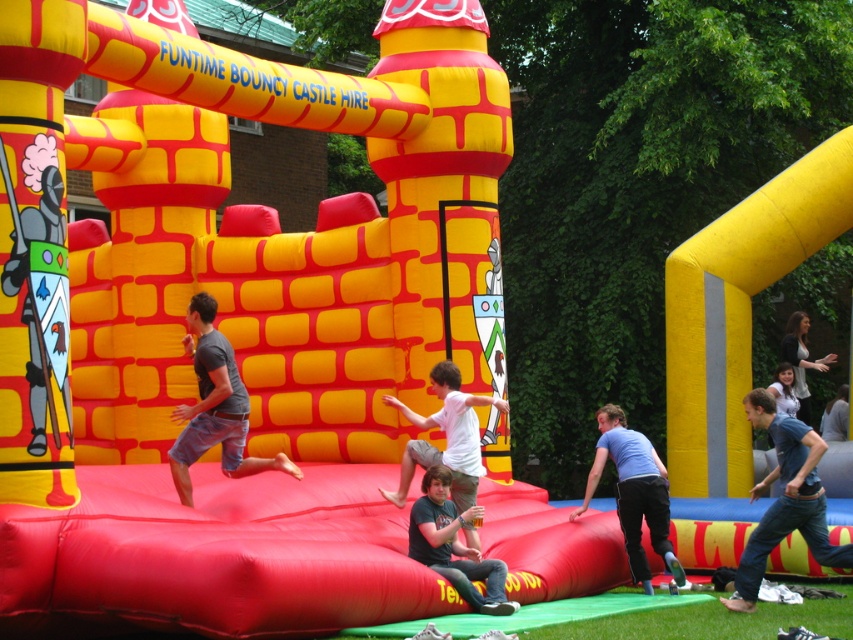
Does blue jeans at center have a lesser width compared to jeans at center?

In fact, blue jeans at center might be wider than jeans at center.

Which is in front, point (759, 424) or point (456, 545)?

Positioned in front is point (456, 545).

Find the location of `blue jeans at center`. blue jeans at center is located at coordinates (785, 499).

Which is in front, point (206, 368) or point (508, 404)?

Point (206, 368) is more forward.

Is matte gray t-shirt at center further to the viewer compared to white matte shirt at center?

No, it is not.

Does point (175, 445) come closer to viewer compared to point (456, 404)?

Yes.

The width and height of the screenshot is (853, 640). What are the coordinates of `matte gray t-shirt at center` in the screenshot? It's located at (213, 406).

Which is behind, point (799, 518) or point (184, 500)?

The point (184, 500) is behind.

Can you confirm if blue jeans at center is smaller than matte gray t-shirt at center?

Incorrect, blue jeans at center is not smaller in size than matte gray t-shirt at center.

The image size is (853, 640). Describe the element at coordinates (785, 499) in the screenshot. I see `blue jeans at center` at that location.

Where is `blue jeans at center`? The height and width of the screenshot is (640, 853). blue jeans at center is located at coordinates (785, 499).